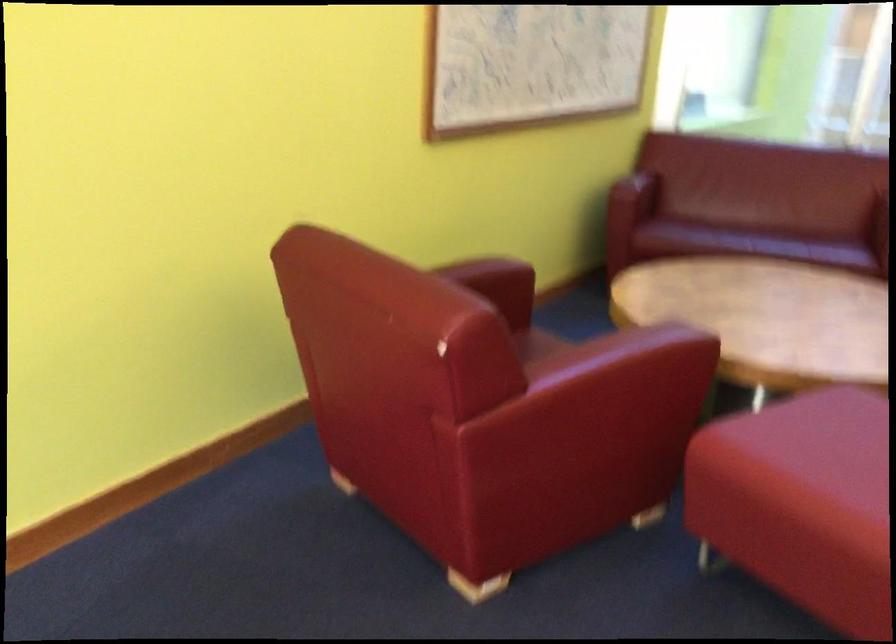
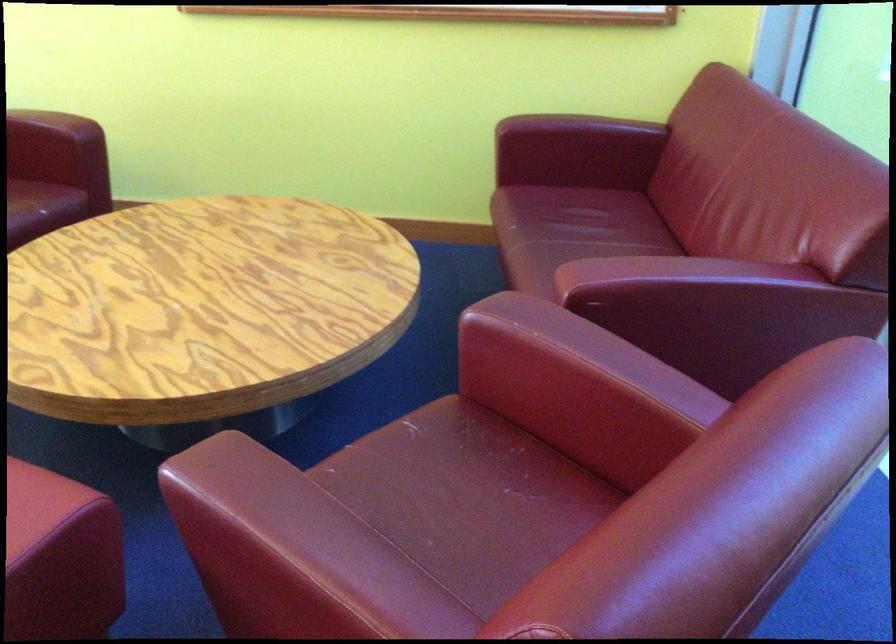
Where in the second image is the point corresponding to point 642,169 from the first image?

(582, 127)